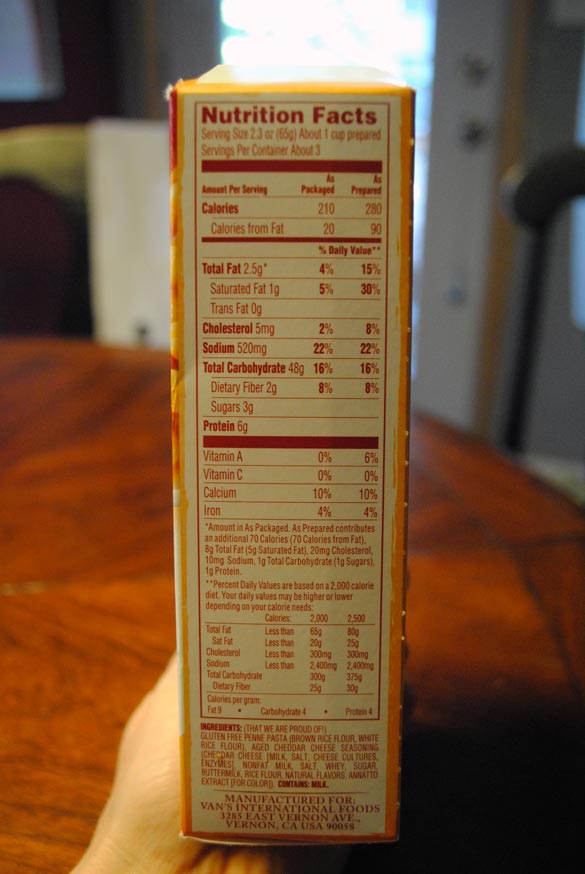
Where is `door lock`? door lock is located at coordinates (473, 66), (474, 139), (457, 283).